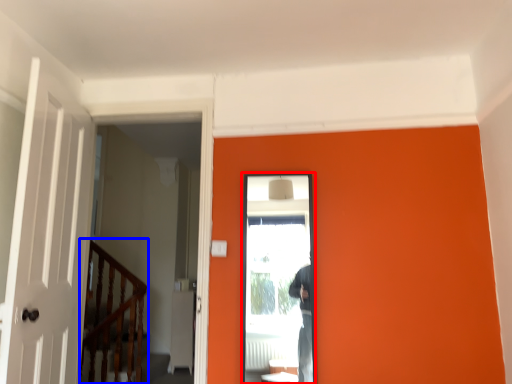
Question: Which object appears farthest to the camera in this image, screen door (highlighted by a red box) or rail (highlighted by a blue box)?

Choices:
 (A) screen door
 (B) rail

Answer: (B)